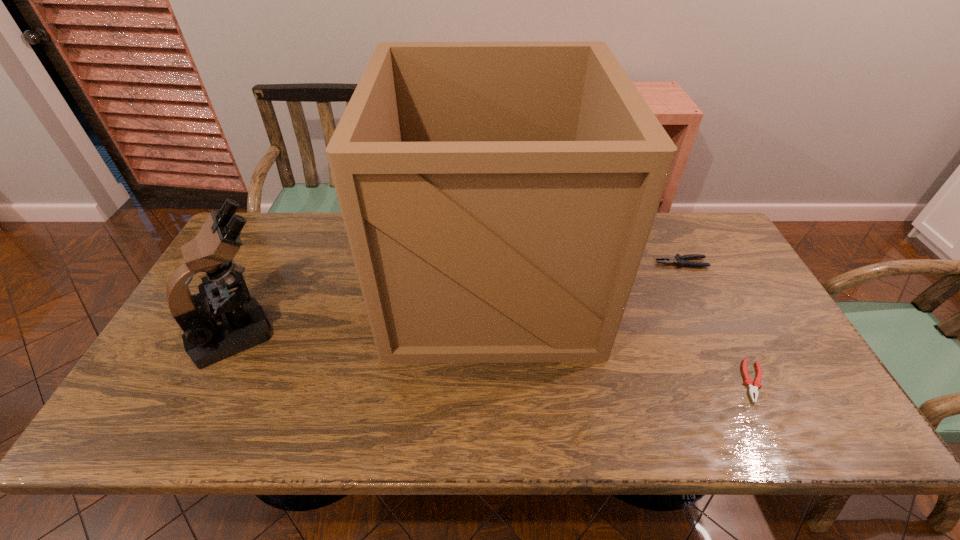
The height and width of the screenshot is (540, 960). Identify the location of the tallest object. coord(498,197).

Identify the location of the second object from left to right. Image resolution: width=960 pixels, height=540 pixels. (498, 197).

What are the coordinates of `the leftmost object` in the screenshot? It's located at (214, 327).

The height and width of the screenshot is (540, 960). What are the coordinates of `microscope` in the screenshot? It's located at (214, 327).

What are the coordinates of `the third tallest object` in the screenshot? It's located at (679, 260).

Identify the location of the taller pliers. (679, 260).

Locate an element on the screen. the shorter pliers is located at coordinates (753, 387).

Identify the location of the shortest object. The height and width of the screenshot is (540, 960). (753, 387).

The height and width of the screenshot is (540, 960). In order to click on vacant space located on the right of the tallest object in this screenshot , I will do [610, 282].

Identify the location of vacant space located 0.230m on the back of the leftmost object. (280, 249).